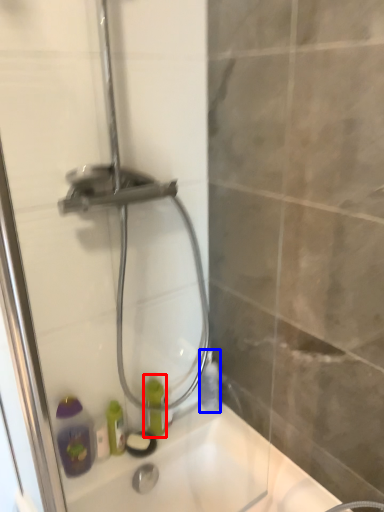
Question: Among these objects, which one is nearest to the camera, bottle (highlighted by a red box) or bottle (highlighted by a blue box)?

Choices:
 (A) bottle
 (B) bottle

Answer: (A)